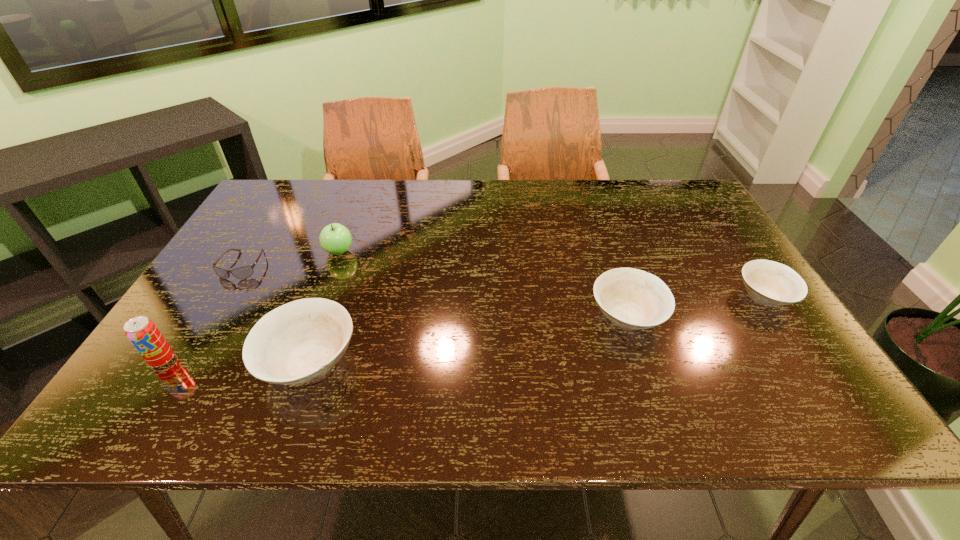
Locate an element on the screen. The height and width of the screenshot is (540, 960). blank space at the far edge is located at coordinates (338, 218).

The image size is (960, 540). Find the location of `vacant space at the near edge of the desktop`. vacant space at the near edge of the desktop is located at coordinates [x=524, y=361].

Locate an element on the screen. vacant space at the left edge is located at coordinates (274, 235).

You are a GUI agent. You are given a task and a screenshot of the screen. Output one action in this format:
    pyautogui.click(x=<x>, y=<y>)
    Task: Click on the free space at the right edge of the desktop
    
    Given the screenshot: What is the action you would take?
    pyautogui.click(x=697, y=248)

Find the location of `vacant space that is in between the sunglasses and the fifth object from left to right`. vacant space that is in between the sunglasses and the fifth object from left to right is located at coordinates (435, 291).

Locate an element on the screen. blank region between the shortest object and the apple is located at coordinates (291, 259).

At what (x,y) coordinates should I click in order to perform the action: click on vacant space that's between the sunglasses and the tallest object. Please return your answer as a coordinate pair (x, y). The width and height of the screenshot is (960, 540). Looking at the image, I should click on (203, 313).

Image resolution: width=960 pixels, height=540 pixels. In order to click on empty space between the apple and the shortest bowl in this screenshot , I will do `click(552, 274)`.

Where is `free space between the third shortest object and the apple`? The image size is (960, 540). free space between the third shortest object and the apple is located at coordinates (483, 284).

Locate an element on the screen. unoccupied area between the tallest bowl and the second object from right to left is located at coordinates (468, 339).